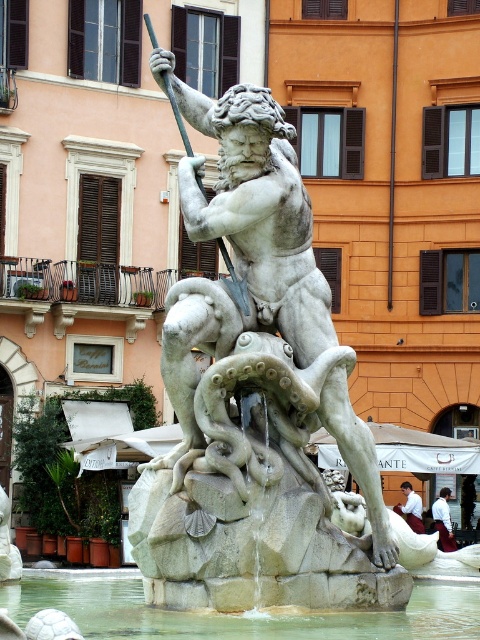
You are an art conservator assessing the placement of the white marble statue at center and the clear stone water at center in the fountain. Based on their heights, which object should be adjusted to ensure the statue is not obstructed by the water? Please explain your reasoning.

The white marble statue at center is taller than the clear stone water at center. To ensure the statue is not obstructed by the water, the clear stone water at center should be adjusted to be taller so it can reach the statue and flow around it without blocking the view.

You are standing in front of a large fountain area and want to take a photo of the white marble statue at center. The camera you have can focus on subjects up to 20 meters away. Will you be able to take a clear photo of the statue from your current position?

The white marble statue at center and camera are 23.26 meters apart, which is beyond the camera focus range of 20 meters. Therefore, you cannot take a clear photo of the statue from your current position.